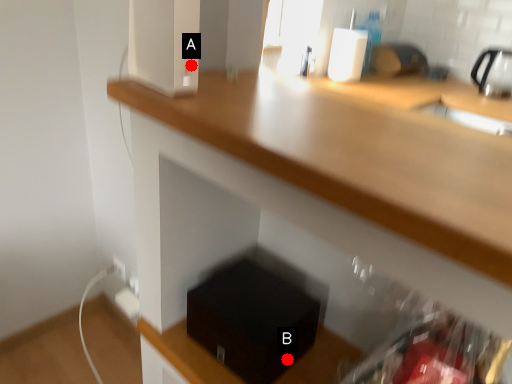
Question: Two points are circled on the image, labeled by A and B beside each circle. Which point appears farthest from the camera in this image?

Choices:
 (A) A is further
 (B) B is further

Answer: (B)